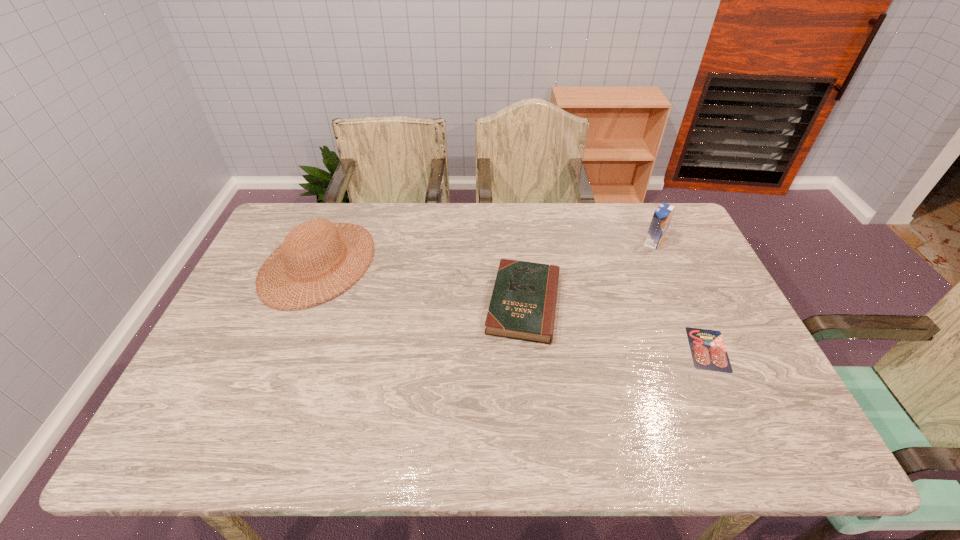
At what (x,y) coordinates should I click in order to perform the action: click on orange_juice that is at the far edge. Please return your answer as a coordinate pair (x, y). The height and width of the screenshot is (540, 960). Looking at the image, I should click on (662, 215).

Where is `sunhat at the far edge`? The image size is (960, 540). sunhat at the far edge is located at coordinates (298, 241).

This screenshot has height=540, width=960. I want to click on object that is at the left edge, so tap(298, 241).

Locate an element on the screen. The image size is (960, 540). orange_juice at the right edge is located at coordinates (662, 215).

Identify the location of salami positioned at the right edge. (708, 351).

I want to click on object located at the far left corner, so click(x=298, y=241).

Image resolution: width=960 pixels, height=540 pixels. In order to click on object present at the far right corner in this screenshot , I will do `click(662, 215)`.

In the image, there is a desktop. At what (x,y) coordinates should I click in order to perform the action: click on vacant space at the far edge. Please return your answer as a coordinate pair (x, y). The image size is (960, 540). Looking at the image, I should click on (432, 230).

In the image, there is a desktop. In order to click on vacant area at the left edge in this screenshot , I will do `click(237, 374)`.

Where is `vacant point at the right edge`? Image resolution: width=960 pixels, height=540 pixels. vacant point at the right edge is located at coordinates (766, 387).